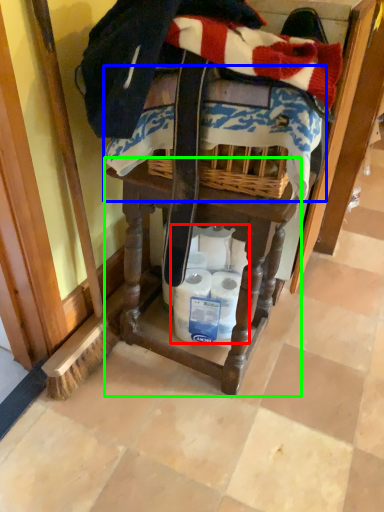
Question: Estimate the real-world distances between objects in this image. Which object is closer to toilet paper (highlighted by a red box), underclothes (highlighted by a blue box) or vanity (highlighted by a green box)?

Choices:
 (A) underclothes
 (B) vanity

Answer: (B)